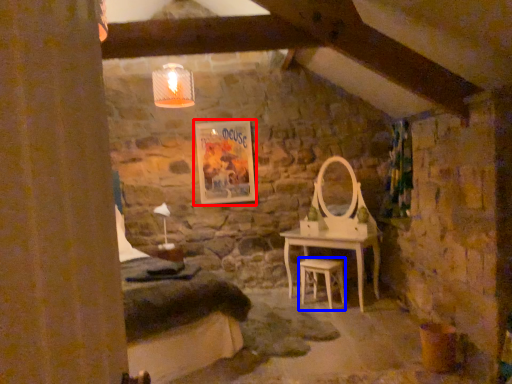
Question: Which point is closer to the camera, picture frame (highlighted by a red box) or stool (highlighted by a blue box)?

Choices:
 (A) picture frame
 (B) stool

Answer: (B)